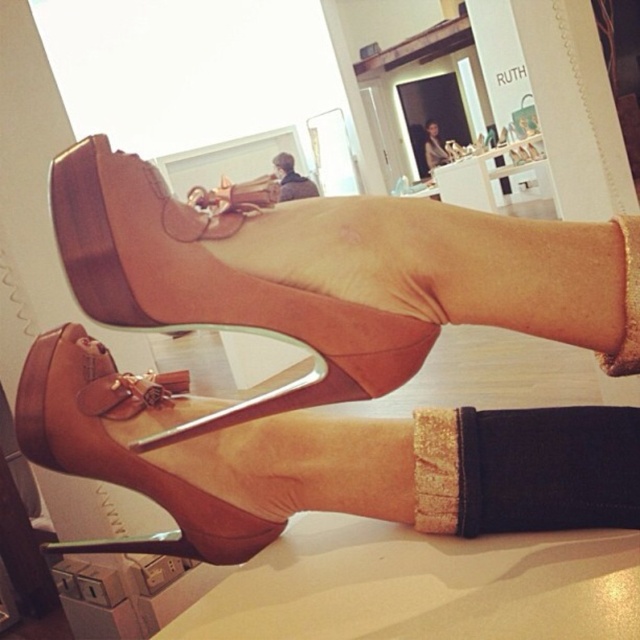
In the scene shown: Does suede high-heeled shoe at center have a larger size compared to suede brown sandal at center?

Yes, suede high-heeled shoe at center is bigger than suede brown sandal at center.

Can you confirm if suede high-heeled shoe at center is thinner than suede brown sandal at center?

Incorrect, suede high-heeled shoe at center's width is not less than suede brown sandal at center's.

Who is more forward, (522,476) or (358,312)?

Point (358,312) is in front.

Image resolution: width=640 pixels, height=640 pixels. Find the location of `suede high-heeled shoe at center`. suede high-heeled shoe at center is located at coordinates (328, 360).

Is point (259, 429) closer to viewer compared to point (243, 540)?

Yes, it is.

Which is behind, point (412, 218) or point (125, 465)?

Point (125, 465)

Who is more forward, (264, 467) or (36, 416)?

Point (36, 416)

You are a GUI agent. You are given a task and a screenshot of the screen. Output one action in this format:
    pyautogui.click(x=<x>, y=<y>)
    Task: Click on the suede high-heeled shoe at center
    
    Given the screenshot: What is the action you would take?
    (x=328, y=360)

Between brown leather shoe at center and matte brown shoe at upper center, which one appears on the right side from the viewer's perspective?

Positioned to the right is matte brown shoe at upper center.

Which of these two, brown leather shoe at center or matte brown shoe at upper center, stands taller?

Standing taller between the two is matte brown shoe at upper center.

Is point (164, 481) closer to camera compared to point (448, 150)?

Yes, point (164, 481) is closer to viewer.

You are a GUI agent. You are given a task and a screenshot of the screen. Output one action in this format:
    pyautogui.click(x=<x>, y=<y>)
    Task: Click on the brown leather shoe at center
    
    Given the screenshot: What is the action you would take?
    pyautogui.click(x=118, y=456)